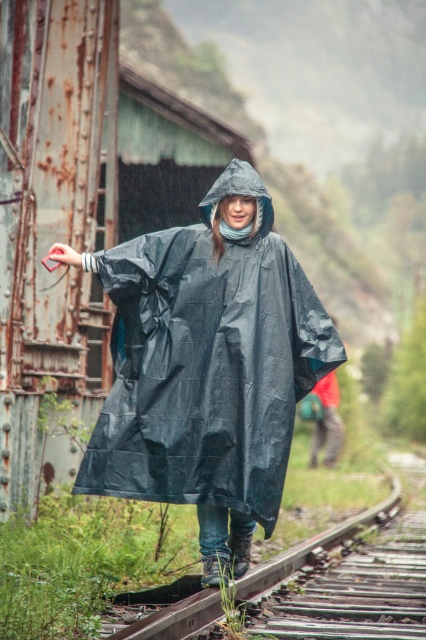
Question: Does brown wooden track at center have a smaller size compared to red fabric umbrella at center?

Choices:
 (A) no
 (B) yes

Answer: (B)

Question: Which object appears farthest from the camera in this image?

Choices:
 (A) red fabric umbrella at center
 (B) black plastic poncho at center
 (C) brown wooden track at center

Answer: (A)

Question: Does black plastic poncho at center have a smaller size compared to black matte raincoat at center?

Choices:
 (A) no
 (B) yes

Answer: (A)

Question: Estimate the real-world distances between objects in this image. Which object is farther from the black matte raincoat at center?

Choices:
 (A) black plastic poncho at center
 (B) brown wooden track at center

Answer: (B)

Question: Which point is farther from the camera taking this photo?

Choices:
 (A) (405, 611)
 (B) (227, 244)
 (C) (325, 454)
 (D) (210, 196)

Answer: (C)

Question: Can you confirm if black plastic poncho at center is positioned below black matte raincoat at center?

Choices:
 (A) yes
 (B) no

Answer: (A)